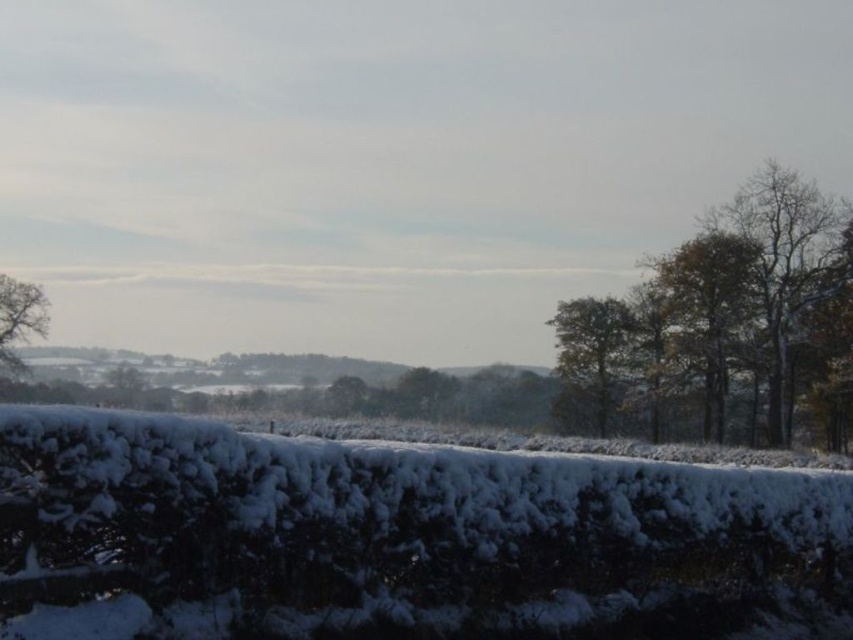
You are standing in the winter landscape and want to walk towards the green leafy tree at center. Which direction should you go to avoid walking into the smooth brown tree at left?

The green leafy tree at center is in front of the smooth brown tree at left, so walking towards the green leafy tree at center will naturally avoid the smooth brown tree at left as it is positioned behind it.

You are standing in the winter landscape and want to walk from the white fluffy hedge at lower center to the green leafy tree at center. Which direction should you move to reach the tree?

You should move to the right side to reach the green leafy tree at center because the white fluffy hedge at lower center is positioned on the left side of it.

You are standing in the winter landscape and want to take a photo. There are two points of interest marked as point (566, 344) and point (45, 312). Which point will appear larger in your photo?

Point (566, 344) is closer to the camera than point (45, 312), so it will appear larger in the photo.